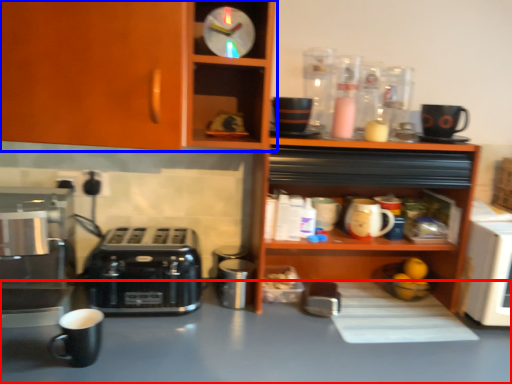
Question: Among these objects, which one is farthest to the camera, table (highlighted by a red box) or cabinetry (highlighted by a blue box)?

Choices:
 (A) table
 (B) cabinetry

Answer: (B)